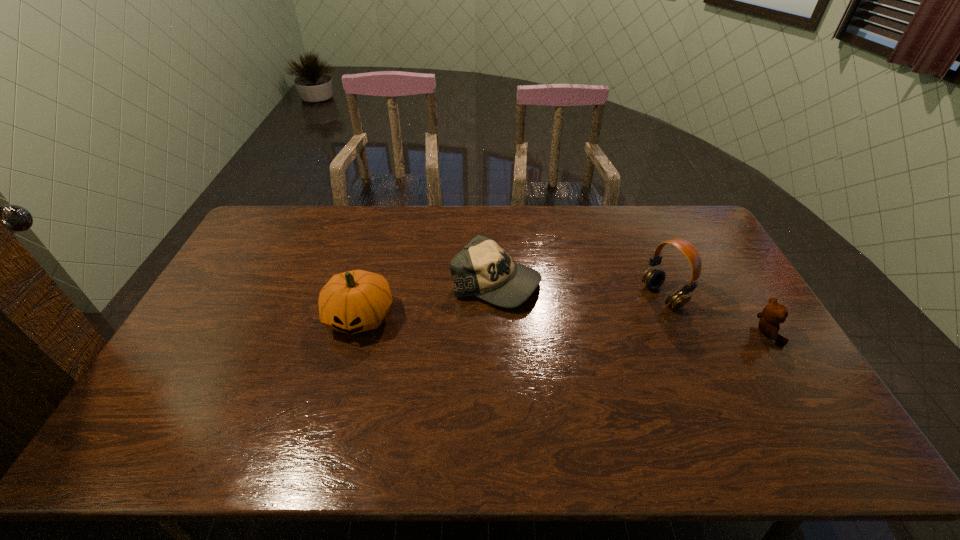
The width and height of the screenshot is (960, 540). I want to click on empty space that is in between the second object from left to right and the rightmost object, so click(x=632, y=308).

Find the location of a particular element. free space between the gourd and the rightmost object is located at coordinates (563, 325).

The image size is (960, 540). Find the location of `vacant point located between the baseball cap and the headset`. vacant point located between the baseball cap and the headset is located at coordinates (579, 289).

This screenshot has width=960, height=540. Identify the location of vacant area between the teddy bear and the headset. (714, 315).

Where is `unoccupied position between the leftmost object and the rightmost object`? unoccupied position between the leftmost object and the rightmost object is located at coordinates (563, 325).

Where is `free spot between the third object from left to right and the third object from right to left`? The width and height of the screenshot is (960, 540). free spot between the third object from left to right and the third object from right to left is located at coordinates tap(579, 289).

The image size is (960, 540). I want to click on the closest object to the third object from left to right, so click(774, 313).

Identify which object is the nearest to the third object from right to left. Please provide its 2D coordinates. Your answer should be formatted as a tuple, i.e. [(x, y)], where the tuple contains the x and y coordinates of a point satisfying the conditions above.

[(355, 301)]

Locate an element on the screen. free space that satisfies the following two spatial constraints: 1. on the side of the rightmost object with the carved face; 2. on the front-facing side of the third shortest object is located at coordinates (355, 333).

Where is `vacant space that satisfies the following two spatial constraints: 1. on the side of the gourd with the carved face; 2. on the front-facing side of the teddy bear`? This screenshot has height=540, width=960. vacant space that satisfies the following two spatial constraints: 1. on the side of the gourd with the carved face; 2. on the front-facing side of the teddy bear is located at coordinates (355, 333).